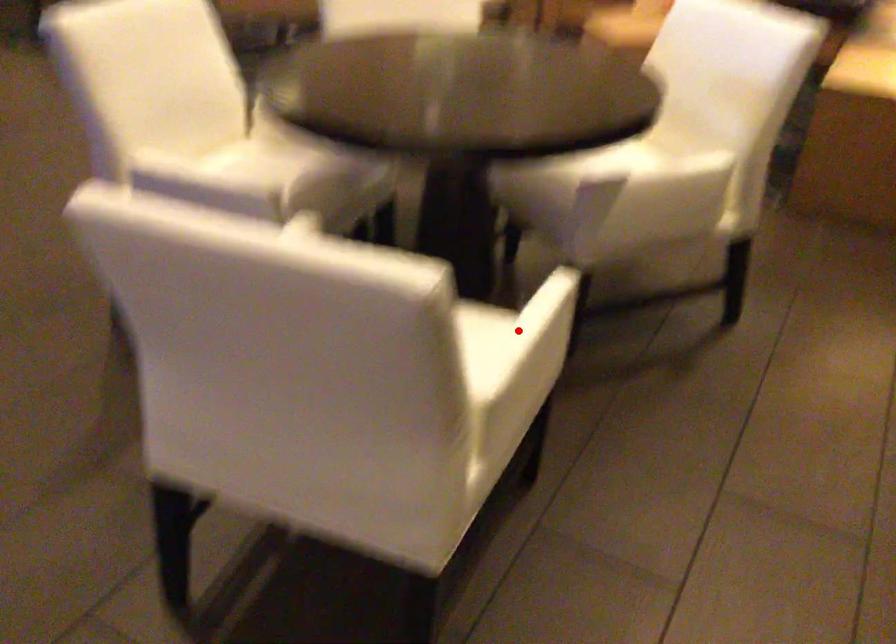
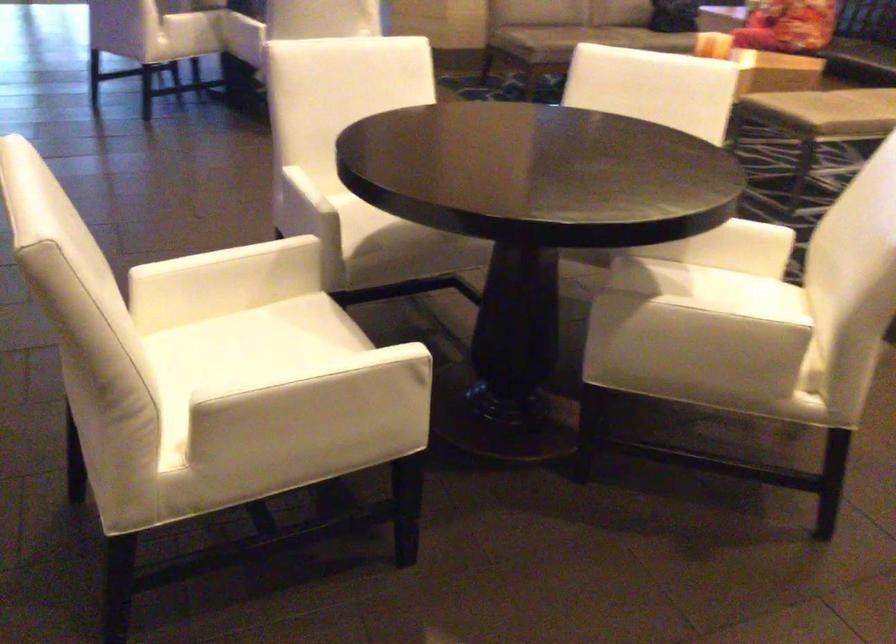
Find the pixel in the second image that matches the highlighted location in the first image.

(300, 373)